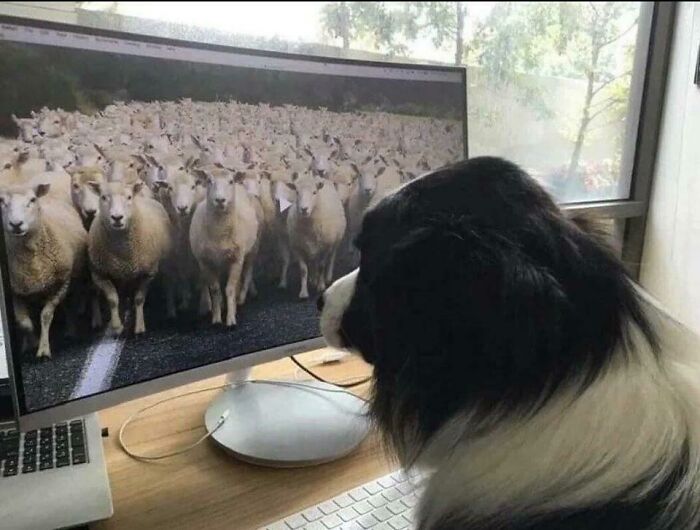
The height and width of the screenshot is (530, 700). I want to click on computer moniter, so click(x=186, y=337).